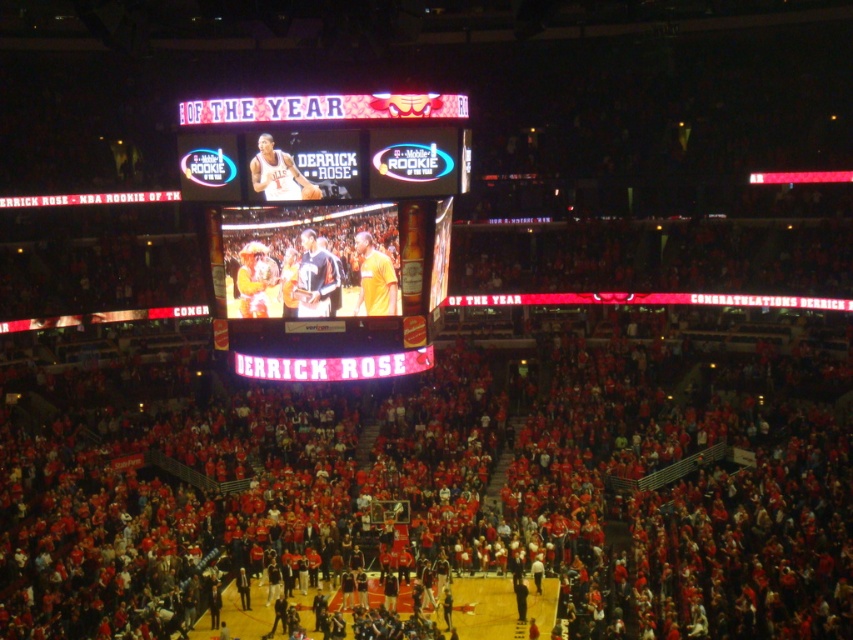
Question: Which of the following is the farthest from the observer?

Choices:
 (A) (440, 193)
 (B) (279, 188)

Answer: (A)

Question: Can you confirm if matte plastic scoreboard at center is positioned above matte white basketball at upper center?

Choices:
 (A) yes
 (B) no

Answer: (B)

Question: Can you confirm if matte plastic scoreboard at center is positioned above matte white basketball at upper center?

Choices:
 (A) no
 (B) yes

Answer: (A)

Question: Is matte plastic scoreboard at center closer to the viewer compared to matte white basketball at upper center?

Choices:
 (A) no
 (B) yes

Answer: (A)

Question: Which of the following is the farthest from the observer?

Choices:
 (A) matte white basketball at upper center
 (B) matte plastic scoreboard at center

Answer: (B)

Question: Which point appears closest to the camera in this image?

Choices:
 (A) (311, 157)
 (B) (273, 236)

Answer: (A)